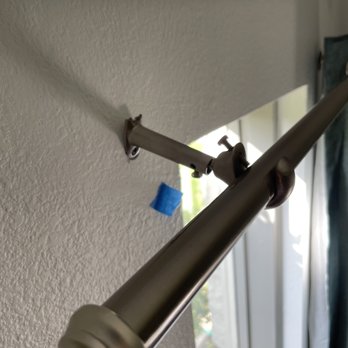
Find the location of a particular element. This screenshot has height=348, width=348. above window is located at coordinates (246, 111).